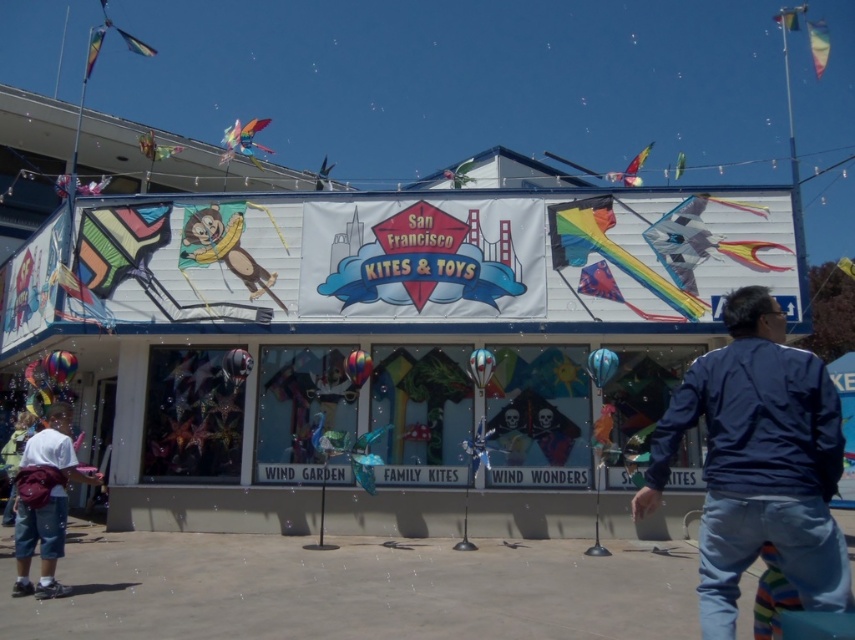
Question: Estimate the real-world distances between objects in this image. Which object is closer to the metallic silver monkey at upper center?

Choices:
 (A) blue fabric jacket at lower right
 (B) translucent plastic kite at upper center

Answer: (B)

Question: Which point is farther to the camera?

Choices:
 (A) (649, 468)
 (B) (181, 145)
 (C) (57, 492)
 (D) (246, 147)

Answer: (B)

Question: Does blue fabric jacket at lower right appear on the right side of white cotton shirt at lower left?

Choices:
 (A) yes
 (B) no

Answer: (A)

Question: Can you confirm if white cotton shirt at lower left is positioned above translucent plastic kite at upper center?

Choices:
 (A) no
 (B) yes

Answer: (A)

Question: Estimate the real-world distances between objects in this image. Which object is farther from the white cotton shirt at lower left?

Choices:
 (A) metallic silver monkey at upper center
 (B) translucent plastic kite at upper center
 (C) blue fabric jacket at lower right

Answer: (A)

Question: Is blue fabric jacket at lower right in front of translucent plastic kite at upper center?

Choices:
 (A) no
 (B) yes

Answer: (B)